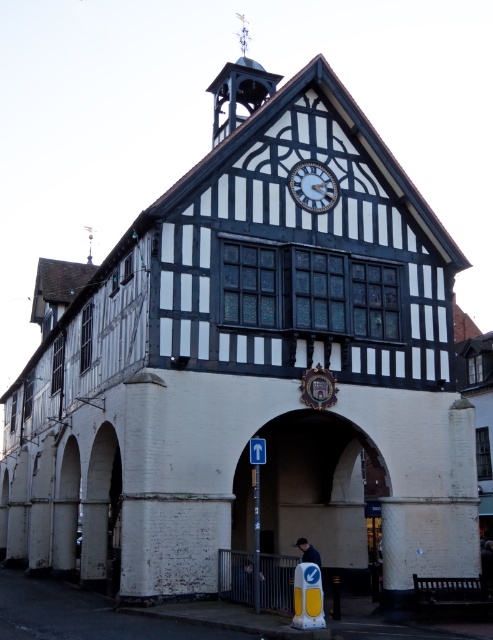
Who is lower down, white brick archway at center or white glossy clock at upper center?

white brick archway at center is lower down.

The image size is (493, 640). In order to click on white brick archway at center in this screenshot , I will do `click(320, 492)`.

Between polished brass bell tower at upper center and white glossy clock at upper center, which one has less height?

With less height is white glossy clock at upper center.

Between point (233, 129) and point (302, 166), which one is positioned in front?

Point (302, 166)

Image resolution: width=493 pixels, height=640 pixels. I want to click on polished brass bell tower at upper center, so click(239, 90).

Does polished brass bell tower at upper center have a lesser height compared to dark blue fabric jacket at lower center?

No.

Is point (269, 80) positioned behind point (305, 561)?

Yes.

Locate an element on the screen. This screenshot has height=640, width=493. polished brass bell tower at upper center is located at coordinates (239, 90).